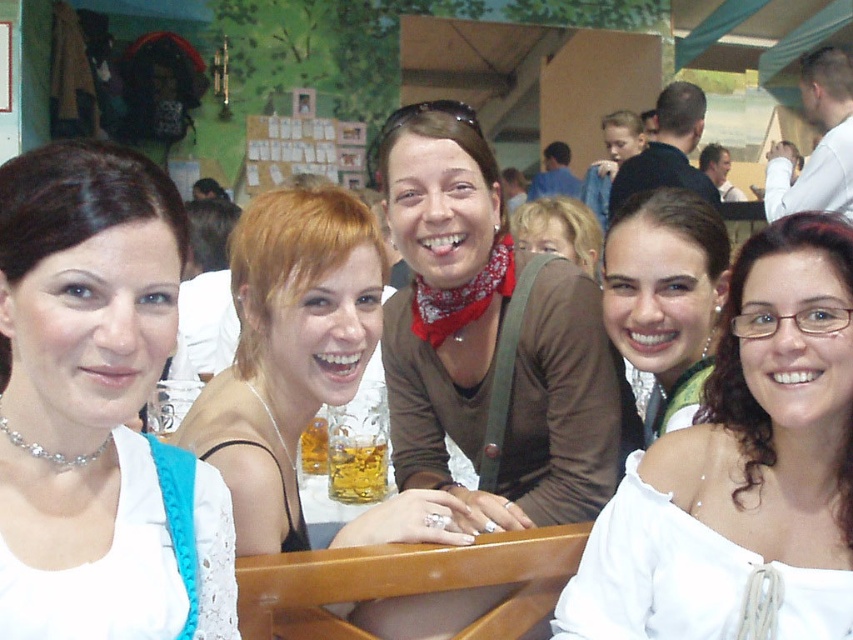
Question: Can you confirm if matte brown hair at center is positioned above matte brown sweater at center?

Choices:
 (A) yes
 (B) no

Answer: (B)

Question: Which point appears farthest from the camera in this image?

Choices:
 (A) (364, 499)
 (B) (570, 212)
 (C) (25, 378)

Answer: (B)

Question: Which object is the farthest from the white satin dress at center?

Choices:
 (A) white satin blouse at lower right
 (B) matte brown hair at center
 (C) matte brown sweater at center
 (D) translucent glass cup at center

Answer: (C)

Question: Among these objects, which one is farthest from the camera?

Choices:
 (A) matte brown sweater at center
 (B) translucent glass cup at center
 (C) blonde hair at center

Answer: (A)

Question: Does matte brown sweater at center have a greater width compared to translucent glass beer at center?

Choices:
 (A) yes
 (B) no

Answer: (A)

Question: Is white satin dress at center in front of matte brown hair at center?

Choices:
 (A) yes
 (B) no

Answer: (A)